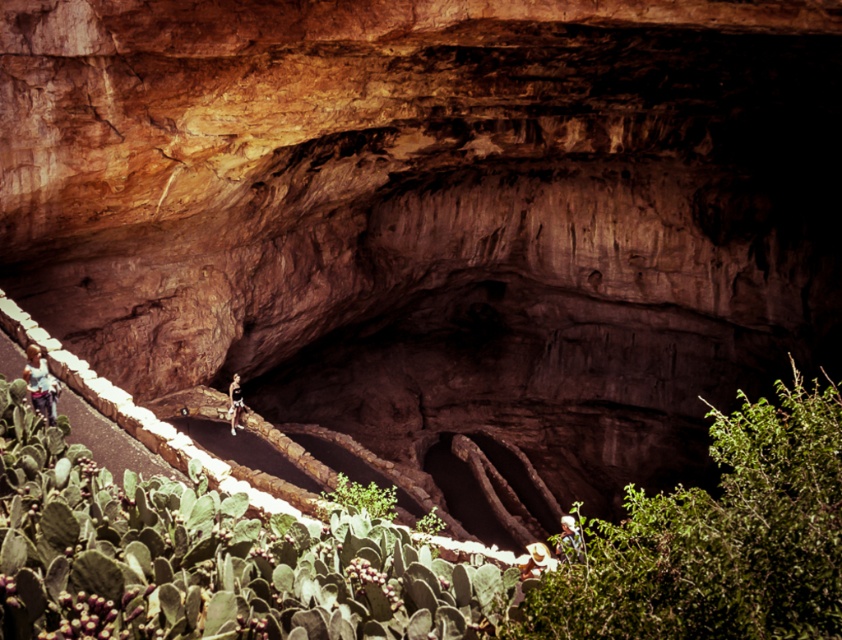
Question: Does green leafy bush at lower right have a greater width compared to white fabric hat at lower center?

Choices:
 (A) yes
 (B) no

Answer: (A)

Question: Which is farther from the light blue denim jeans at left?

Choices:
 (A) green leafy bush at lower right
 (B) light brown leather jacket at center

Answer: (A)

Question: Does green spiky cactus at lower left appear under light brown leather jacket at center?

Choices:
 (A) no
 (B) yes

Answer: (A)

Question: Does light blue denim jeans at left lie in front of white fabric hat at lower center?

Choices:
 (A) yes
 (B) no

Answer: (B)

Question: Which object is positioned closest to the white fabric hat at lower center?

Choices:
 (A) green leafy bush at lower right
 (B) green spiky cactus at lower left
 (C) light blue denim jeans at left
 (D) light brown leather jacket at center

Answer: (A)

Question: Estimate the real-world distances between objects in this image. Which object is farther from the white textured hat at lower center?

Choices:
 (A) green spiky cactus at lower left
 (B) white fabric hat at lower center
 (C) light blue denim jeans at left
 (D) green leafy bush at lower right

Answer: (A)